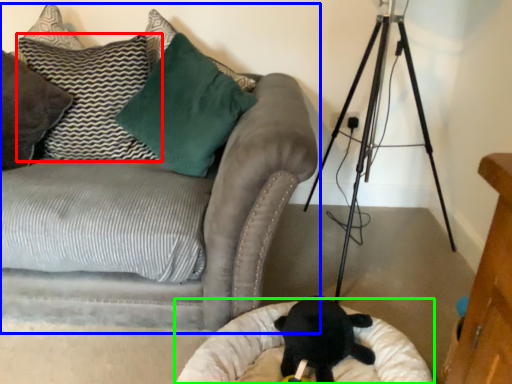
Question: Based on their relative distances, which object is nearer to pillow (highlighted by a red box)? Choose from studio couch (highlighted by a blue box) and cat bed (highlighted by a green box).

Choices:
 (A) studio couch
 (B) cat bed

Answer: (A)